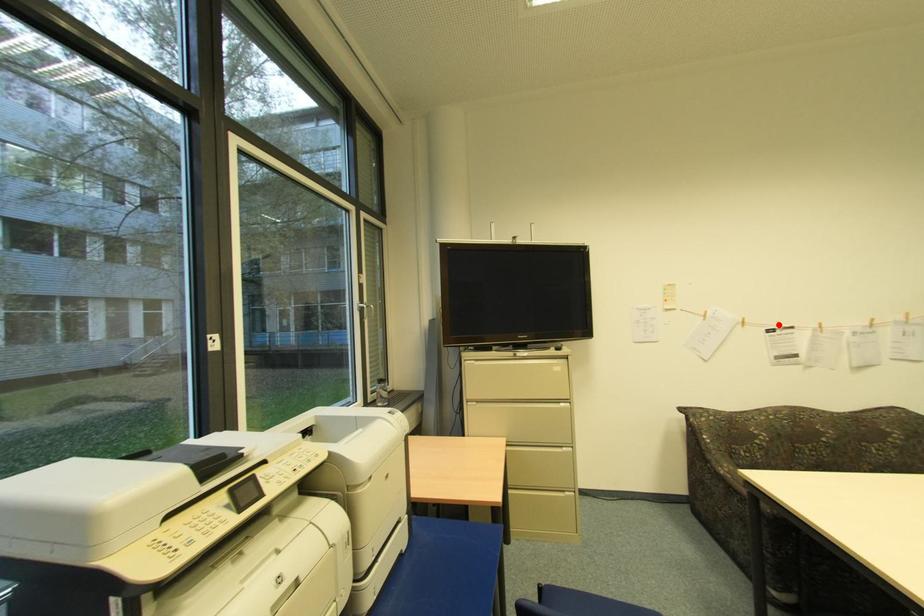
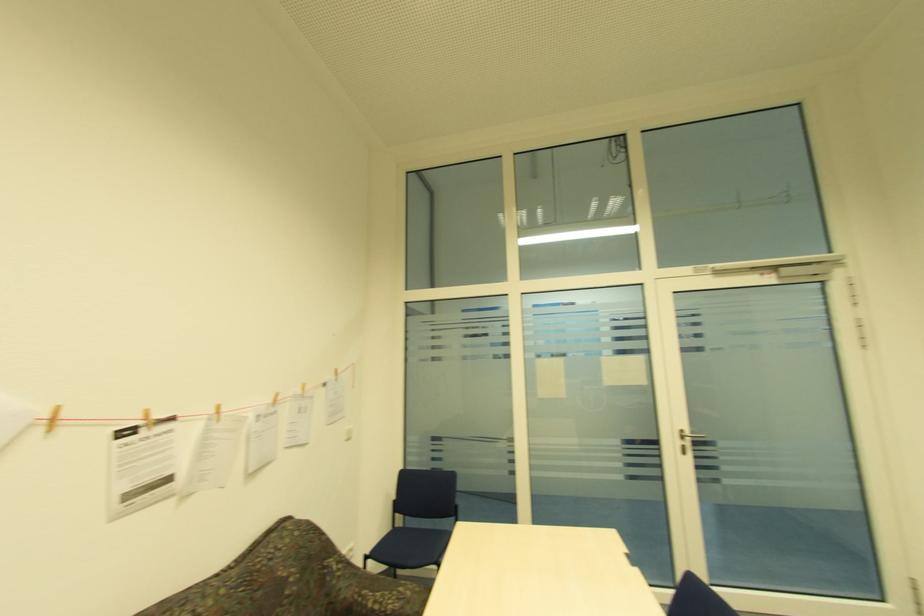
Find the pixel in the second image that matches the highlighted location in the first image.

(141, 416)